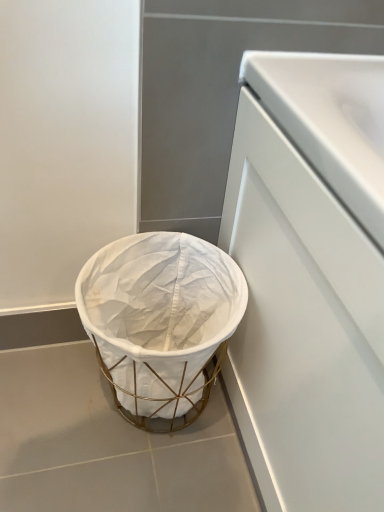
Describe the element at coordinates (161, 322) in the screenshot. I see `white fabric basket at lower left` at that location.

At what (x,y) coordinates should I click in order to perform the action: click on white fabric basket at lower left. Please return your answer as a coordinate pair (x, y). The width and height of the screenshot is (384, 512). Looking at the image, I should click on (161, 322).

I want to click on white fabric basket at lower left, so click(161, 322).